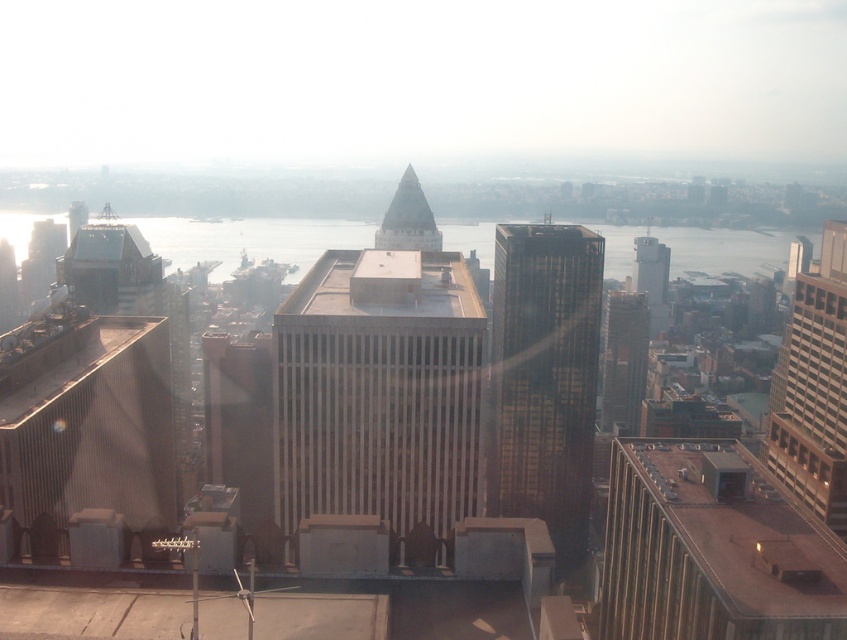
Question: Is brown textured building at center bigger than shiny glass spire at center?

Choices:
 (A) yes
 (B) no

Answer: (A)

Question: Which point appears closest to the camera in this image?

Choices:
 (A) (392, 198)
 (B) (443, 296)
 (C) (497, 480)

Answer: (B)

Question: Is brown glass building at right thinner than glassy reflective skyscraper at center?

Choices:
 (A) no
 (B) yes

Answer: (A)

Question: Which point is farther to the camera?

Choices:
 (A) brown glass building at right
 (B) dark glass skyscraper at center
 (C) brown textured building at center

Answer: (A)

Question: Where is dark glass skyscraper at center located in relation to brown glass building at right in the image?

Choices:
 (A) left
 (B) right

Answer: (A)

Question: Which of the following is the closest to the observer?

Choices:
 (A) (325, 316)
 (B) (826, 412)
 (C) (574, 516)
 (D) (615, 326)

Answer: (A)